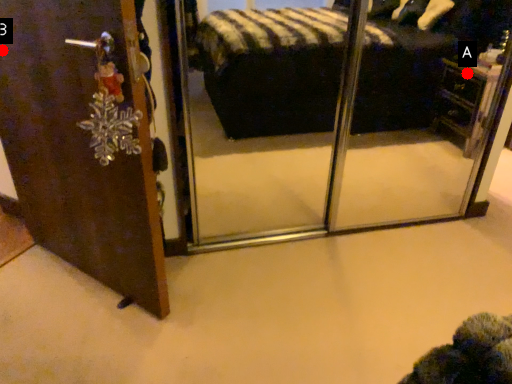
Question: Two points are circled on the image, labeled by A and B beside each circle. Among these points, which one is nearest to the camera?

Choices:
 (A) A is closer
 (B) B is closer

Answer: (B)